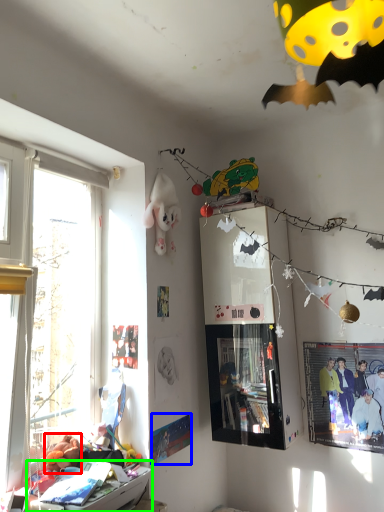
Question: Based on their relative distances, which object is nearer to toy (highlighted by a red box)? Choose from poster page (highlighted by a blue box) and furniture (highlighted by a green box).

Choices:
 (A) poster page
 (B) furniture

Answer: (B)